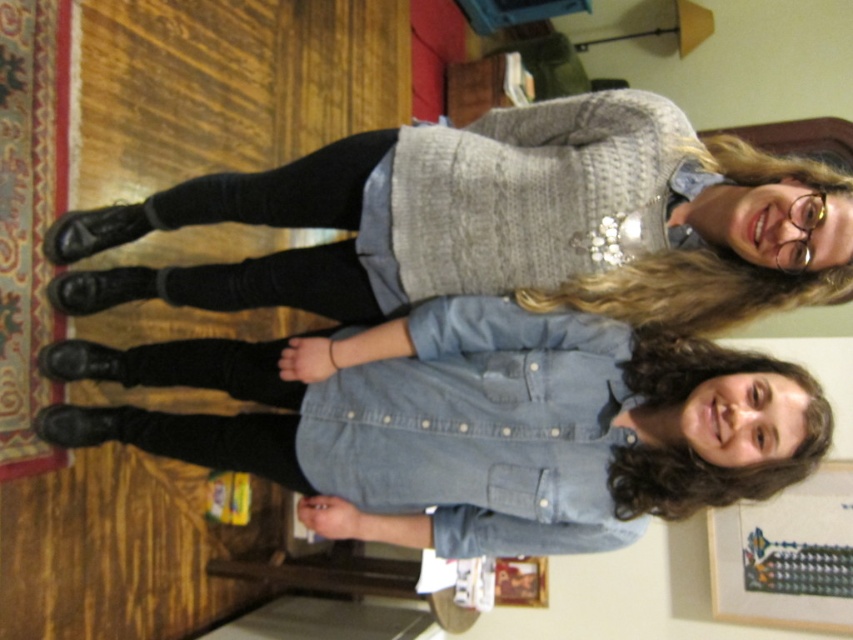
You are standing in a living room and want to place a 1.35 meter long sofa. There is a point marked at coordinates point (634, 141). Can you determine if the sofa will fit from the camera to that point?

The distance between the camera and point (634, 141) is 1.40 meters. Since the sofa is 1.35 meters long, it will fit within that space.

In the living room scene, there are two people wearing the denim shirt at center and the matte gray sweater at center. Which clothing item is positioned more to the left?

The denim shirt at center is positioned to the left of the matte gray sweater at center, so the denim shirt at center is more to the left.

You are standing in the living room and want to move from the point at coordinates point (614, 465) to the point at coordinates point (682, 294). Which direction should you move in?

Since point (614, 465) is behind point (682, 294), you should move forward towards the point at coordinates point (682, 294).